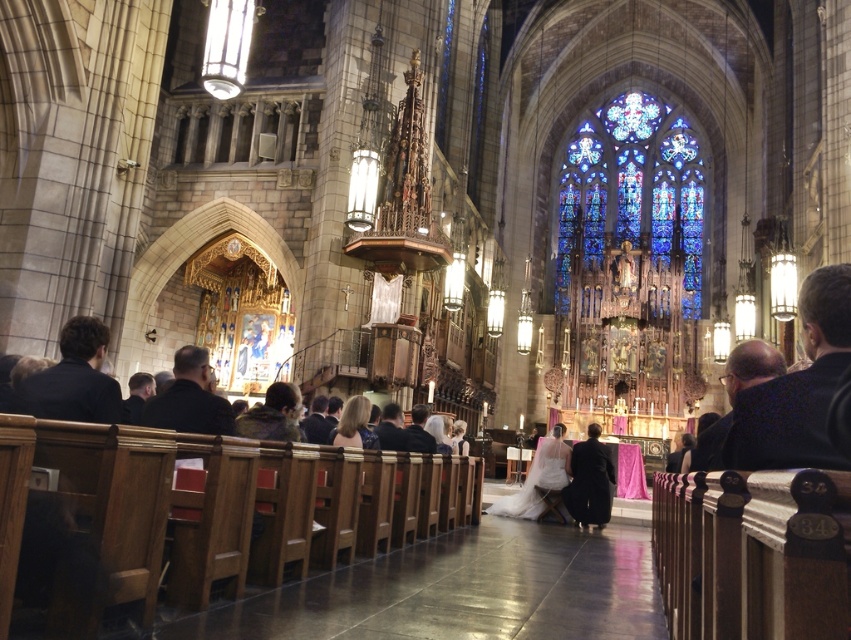
Does stained glass at center appear over dark blue shirt at left?

Correct, stained glass at center is located above dark blue shirt at left.

Can you confirm if stained glass at center is wider than dark blue shirt at left?

Correct, the width of stained glass at center exceeds that of dark blue shirt at left.

This screenshot has width=851, height=640. In order to click on stained glass at center in this screenshot , I will do `click(631, 189)`.

Can you confirm if stained glass at center is bigger than dark blue fabric at right?

Correct, stained glass at center is larger in size than dark blue fabric at right.

Between point (632, 131) and point (817, 456), which one is positioned in front?

Point (817, 456) is more forward.

Who is more forward, (625, 125) or (837, 273)?

Point (837, 273) is in front.

At what (x,y) coordinates should I click in order to perform the action: click on stained glass at center. Please return your answer as a coordinate pair (x, y). Image resolution: width=851 pixels, height=640 pixels. Looking at the image, I should click on (631, 189).

Identify the location of dark blue fabric at right. (797, 387).

Who is more forward, (x=802, y=449) or (x=585, y=465)?

Point (x=802, y=449) is in front.

Between point (834, 369) and point (578, 520), which one is positioned in front?

Point (834, 369) is more forward.

This screenshot has height=640, width=851. What are the coordinates of `dark blue fabric at right` in the screenshot? It's located at (797, 387).